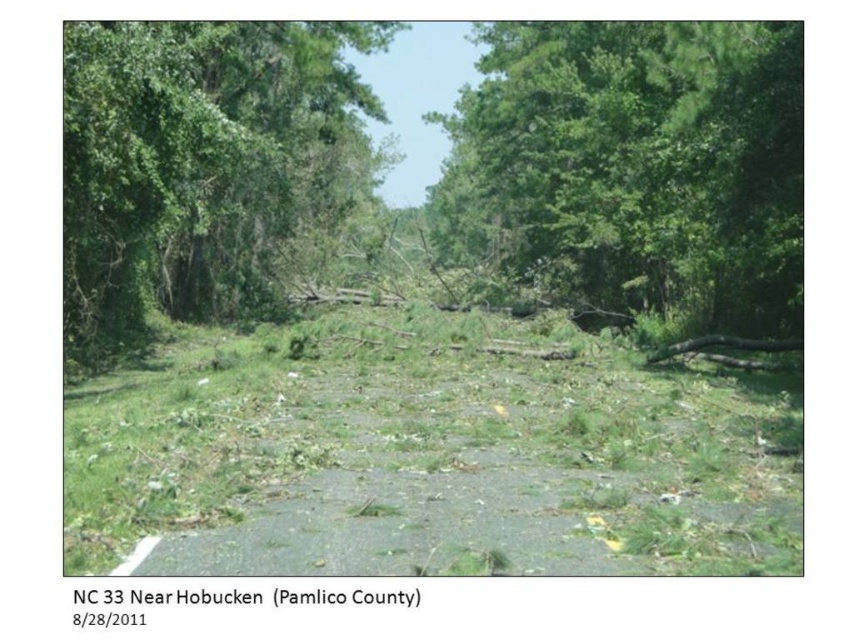
You are a disaster assessment drone operator. Your drone is currently hovering 50 feet above the ground. You need to inspect the green leafy trees at center to assess damage. Can your drone safely descend to 10 feet above the trees to get a closer look without hitting any obstacles?

The green leafy trees at center is 44.63 feet from viewer. Since the drone is currently at 50 feet above the ground, descending to 10 feet above the trees would require a total altitude of 44.63 feet plus 10 feet equals 54.63 feet. However, the drone is only at 50 feet, so it cannot safely descend to 10 feet above the trees without risking collision.

From the picture: Based on the scene described, which object has a greater width between the green leafy trees at center and the green leafy tree at left?

The green leafy trees at center have a greater width compared to the green leafy tree at left.